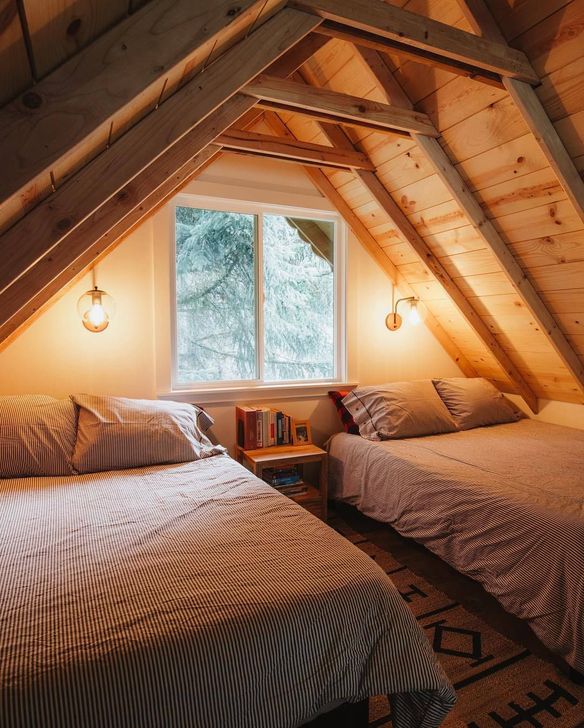
This screenshot has height=728, width=584. What are the coordinates of `rug` in the screenshot? It's located at (481, 691).